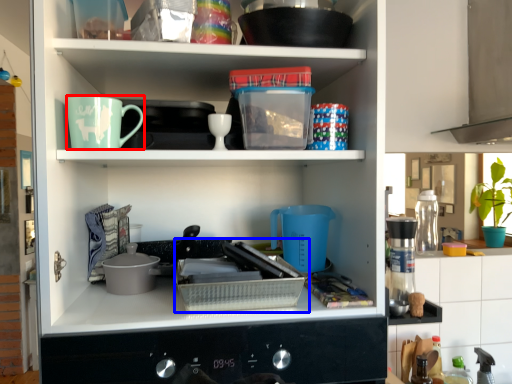
Question: Which of the following is the closest to the observer, coffee cup (highlighted by a red box) or appliance (highlighted by a blue box)?

Choices:
 (A) coffee cup
 (B) appliance

Answer: (B)